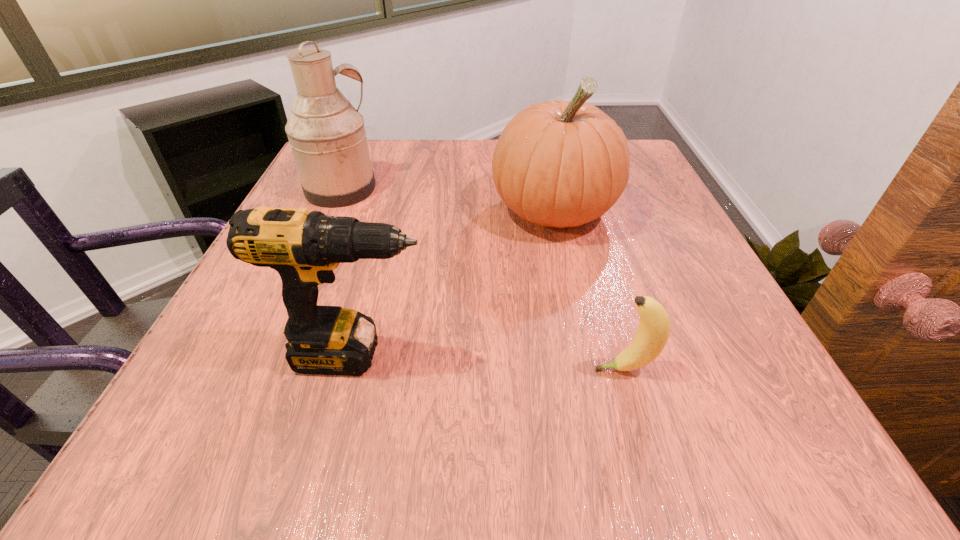
Identify the location of pitcher. The height and width of the screenshot is (540, 960). (327, 136).

Where is `pumpkin`? pumpkin is located at coordinates (559, 164).

You are a GUI agent. You are given a task and a screenshot of the screen. Output one action in this format:
    pyautogui.click(x=<x>, y=<y>)
    Task: Click on the drill
    This screenshot has width=960, height=540.
    Given the screenshot: What is the action you would take?
    pyautogui.click(x=304, y=247)

Where is `the shortest object`? The width and height of the screenshot is (960, 540). the shortest object is located at coordinates (654, 327).

At what (x,y) coordinates should I click in order to perform the action: click on vacant region located 0.160m on the back of the pitcher. Please return your answer as a coordinate pair (x, y). The width and height of the screenshot is (960, 540). Looking at the image, I should click on (363, 143).

You are a GUI agent. You are given a task and a screenshot of the screen. Output one action in this format:
    pyautogui.click(x=<x>, y=<y>)
    Task: Click on the free space located on the stem of the pumpkin
    Image resolution: width=960 pixels, height=540 pixels.
    Given the screenshot: What is the action you would take?
    point(572,294)

At what (x,y) coordinates should I click in order to perform the action: click on vacant area situated at the tip of the drill. Please return your answer as a coordinate pair (x, y). Image resolution: width=960 pixels, height=540 pixels. Looking at the image, I should click on (646, 355).

At what (x,y) coordinates should I click in order to perform the action: click on blank area located 0.350m from the stem of the shortest object. Please return your answer as a coordinate pair (x, y). This screenshot has width=960, height=540. Looking at the image, I should click on (352, 369).

Locate an element on the screen. The width and height of the screenshot is (960, 540). free spot located from the stem of the shortest object is located at coordinates (373, 369).

Identify the location of vacant region located from the stem of the shortest object. (519, 369).